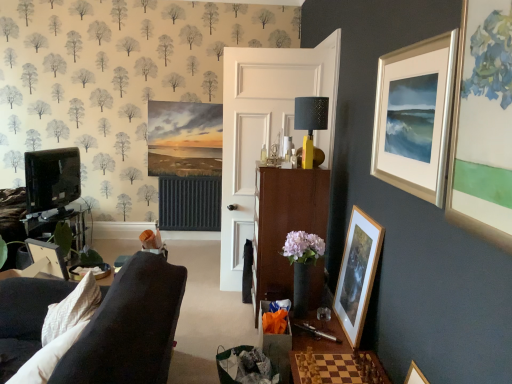
Question: Should I look upward or downward to see yellow matte/black textured lampshade at center?

Choices:
 (A) up
 (B) down

Answer: (A)

Question: From a real-world perspective, is wooden picture frame at lower right, which is the first picture frame in bottom-to-top order, located higher than white wood door at center?

Choices:
 (A) no
 (B) yes

Answer: (A)

Question: From the image's perspective, would you say wooden picture frame at lower right, acting as the 3th picture frame starting from the top, is shown under white wood door at center?

Choices:
 (A) yes
 (B) no

Answer: (A)

Question: Does wooden picture frame at lower right, the second picture frame viewed from the right, have a larger size compared to white wood door at center?

Choices:
 (A) no
 (B) yes

Answer: (A)

Question: Does wooden picture frame at lower right, the second picture frame viewed from the right, touch white wood door at center?

Choices:
 (A) no
 (B) yes

Answer: (A)

Question: Could you tell me if wooden picture frame at lower right, which is the first picture frame in bottom-to-top order, is turned towards white wood door at center?

Choices:
 (A) yes
 (B) no

Answer: (B)

Question: Does wooden picture frame at lower right, the second picture frame viewed from the right, have a lesser height compared to white wood door at center?

Choices:
 (A) no
 (B) yes

Answer: (B)

Question: Is yellow matte/black textured lampshade at center at the left side of wooden chessboard at lower center?

Choices:
 (A) no
 (B) yes

Answer: (B)

Question: Is yellow matte/black textured lampshade at center shorter than wooden chessboard at lower center?

Choices:
 (A) yes
 (B) no

Answer: (B)

Question: Considering the relative sizes of yellow matte/black textured lampshade at center and wooden chessboard at lower center in the image provided, is yellow matte/black textured lampshade at center wider than wooden chessboard at lower center?

Choices:
 (A) no
 (B) yes

Answer: (A)

Question: From the image's perspective, is yellow matte/black textured lampshade at center located above wooden chessboard at lower center?

Choices:
 (A) yes
 (B) no

Answer: (A)

Question: Is yellow matte/black textured lampshade at center taller than wooden chessboard at lower center?

Choices:
 (A) yes
 (B) no

Answer: (A)

Question: From the image's perspective, is yellow matte/black textured lampshade at center located beneath wooden chessboard at lower center?

Choices:
 (A) no
 (B) yes

Answer: (A)

Question: Is wooden picture frame at left, the 3th picture frame when ordered from right to left, bigger than matte black tv stand at left?

Choices:
 (A) yes
 (B) no

Answer: (B)